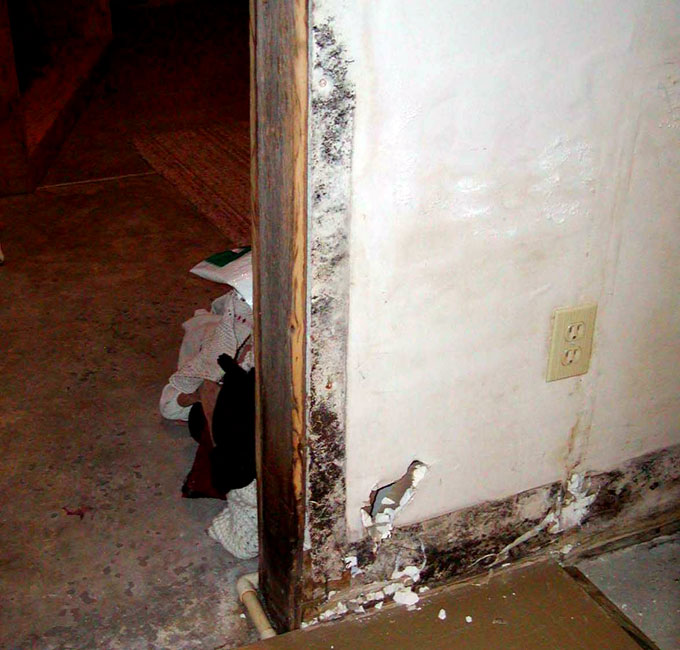
You are a GUI agent. You are given a task and a screenshot of the screen. Output one action in this format:
    pyautogui.click(x=<x>, y=<y>)
    Task: Click on the doorjamb
    
    Given the screenshot: What is the action you would take?
    pyautogui.click(x=273, y=329)